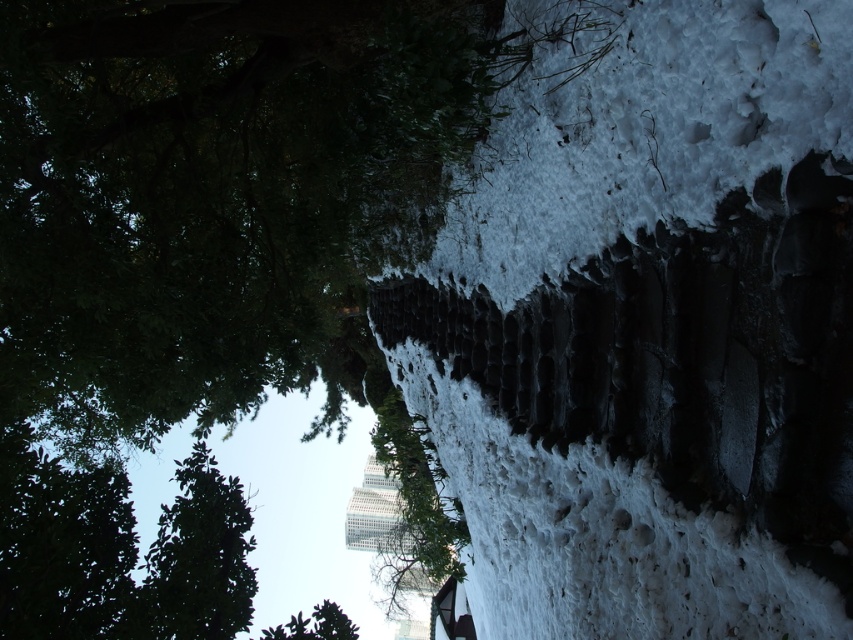
Describe the element at coordinates (648, 326) in the screenshot. I see `white fluffy snow at center` at that location.

Is point (500, 554) farther from camera compared to point (186, 620)?

Yes, it is behind point (186, 620).

Image resolution: width=853 pixels, height=640 pixels. Find the location of `white fluffy snow at center`. white fluffy snow at center is located at coordinates (648, 326).

Which is in front, point (561, 99) or point (242, 621)?

Point (561, 99)

Does white fluffy snow at upper right have a smaller size compared to green leafy tree at upper left?

Indeed, white fluffy snow at upper right has a smaller size compared to green leafy tree at upper left.

The height and width of the screenshot is (640, 853). Identify the location of white fluffy snow at upper right. (642, 128).

Is point (647, 342) in front of point (753, 141)?

No.

From the picture: Between white fluffy snow at center and white fluffy snow at upper right, which one has more height?

Result: white fluffy snow at center

Between point (850, 81) and point (833, 35), which one is positioned in front?

Point (833, 35) is in front.

This screenshot has height=640, width=853. I want to click on white fluffy snow at center, so click(648, 326).